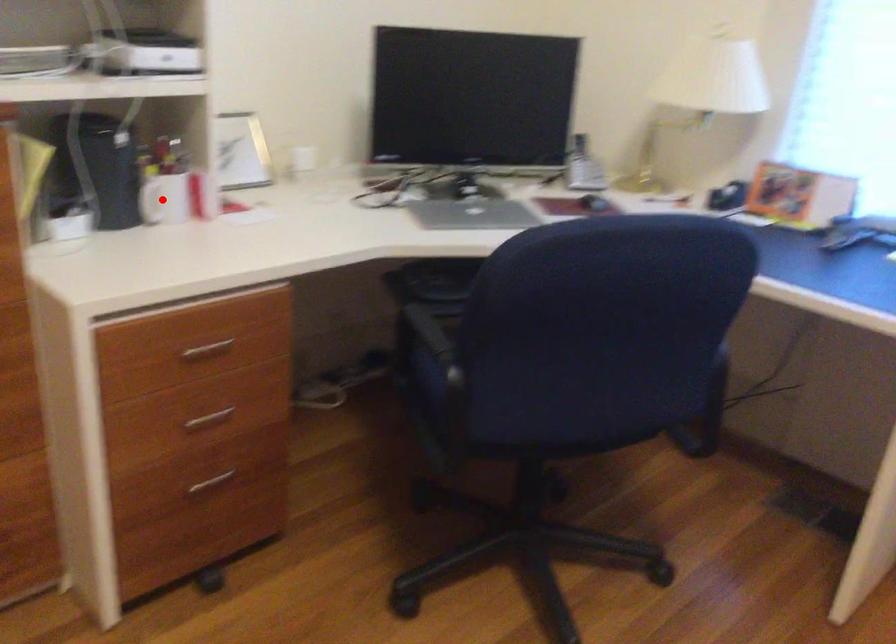
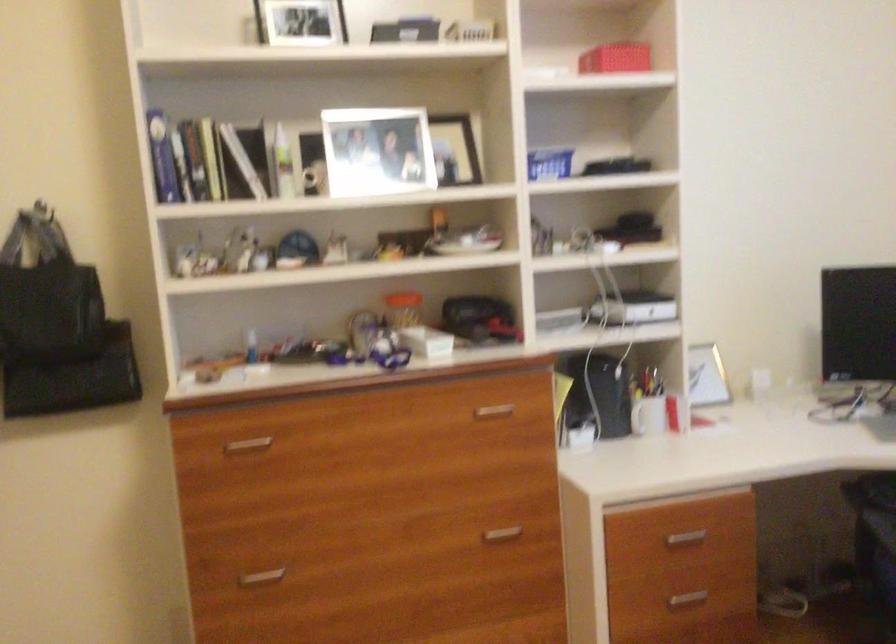
Question: I am providing you with two images of the same scene from different viewpoints. In image1, a red point is highlighted. Considering the same 3D point in image2, which of the following is correct?

Choices:
 (A) It is closer
 (B) It is farther

Answer: (B)